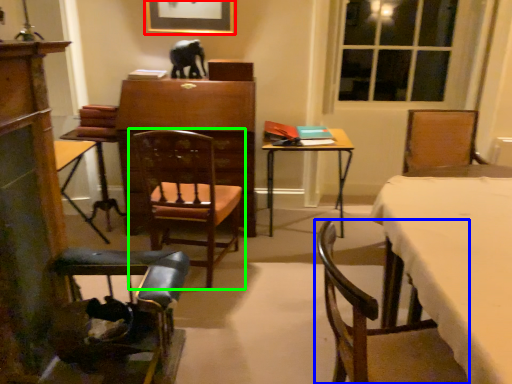
Question: Based on their relative distances, which object is nearer to picture frame (highlighted by a red box)? Choose from chair (highlighted by a blue box) and chair (highlighted by a green box).

Choices:
 (A) chair
 (B) chair

Answer: (B)